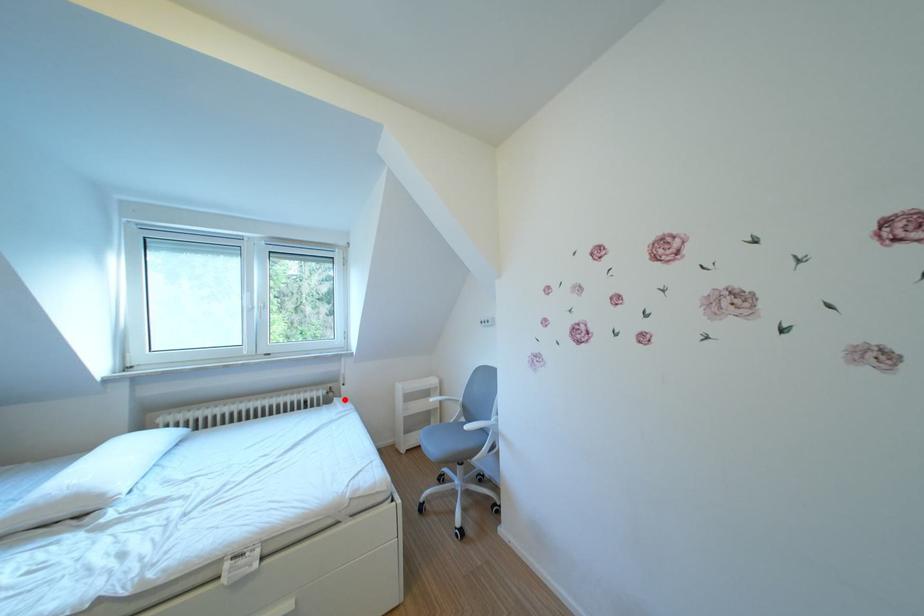
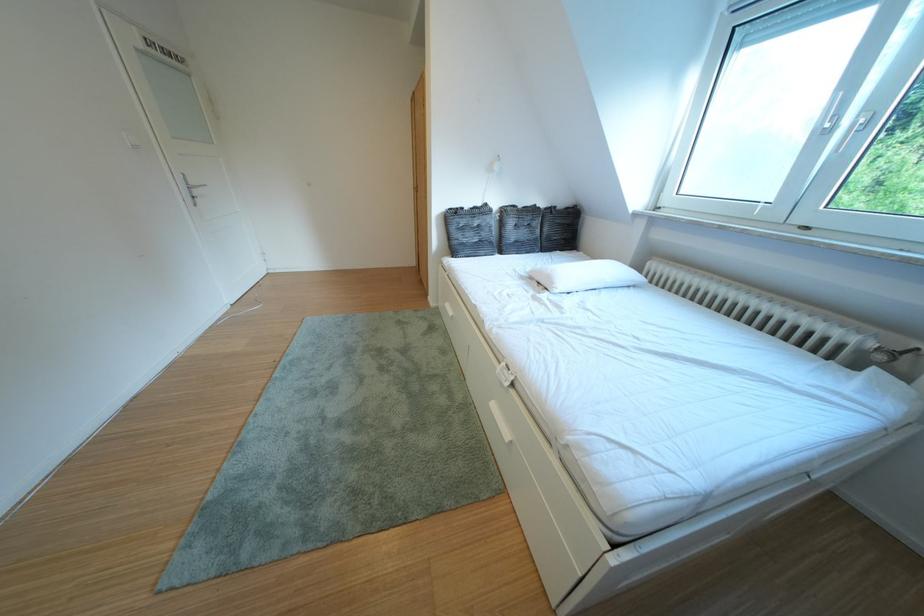
The point at the highlighted location is marked in the first image. Where is the corresponding point in the second image?

(893, 363)